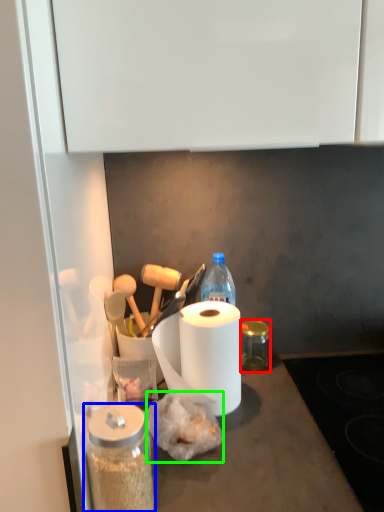
Question: Based on their relative distances, which object is farther from glass jar (highlighted by a red box)? Choose from glass jar (highlighted by a blue box) and food (highlighted by a green box).

Choices:
 (A) glass jar
 (B) food

Answer: (A)